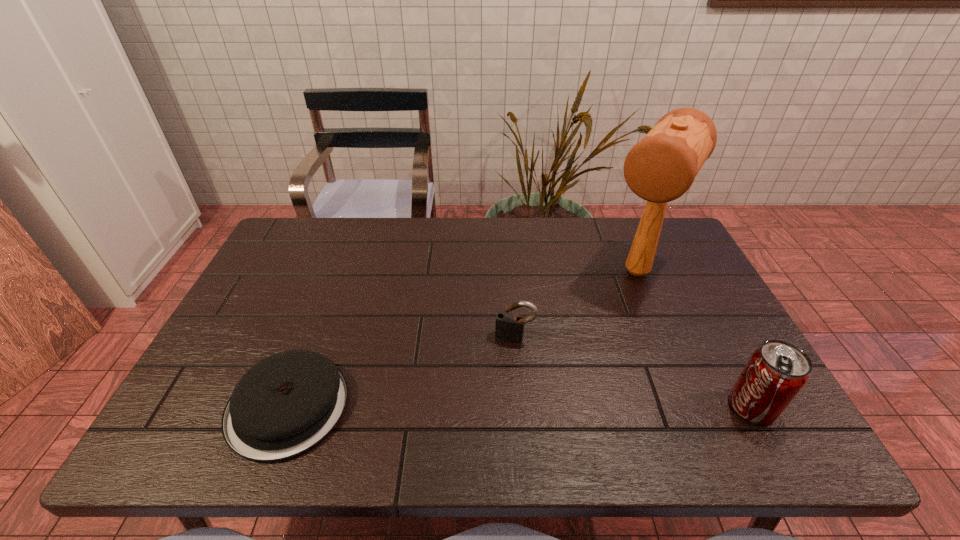
Image resolution: width=960 pixels, height=540 pixels. What are the coordinates of `free area in between the pop soda and the padlock` in the screenshot? It's located at (634, 372).

Locate which object is the closest to the tallest object. Please provide its 2D coordinates. Your answer should be formatted as a tuple, i.e. [(x, y)], where the tuple contains the x and y coordinates of a point satisfying the conditions above.

[(510, 327)]

Find the location of a particular element. object that stands as the third closest to the third tallest object is located at coordinates (776, 372).

You are a GUI agent. You are given a task and a screenshot of the screen. Output one action in this format:
    pyautogui.click(x=<x>, y=<y>)
    Task: Click on the free space that satisfies the following two spatial constraints: 1. on the back side of the third nearest object; 2. on the left side of the farthest object
    This screenshot has width=960, height=540.
    Given the screenshot: What is the action you would take?
    pyautogui.click(x=510, y=272)

The image size is (960, 540). What are the coordinates of `vacant position in the image that satisfies the following two spatial constraints: 1. on the front side of the pancake; 2. on the left side of the pop soda` in the screenshot? It's located at (288, 407).